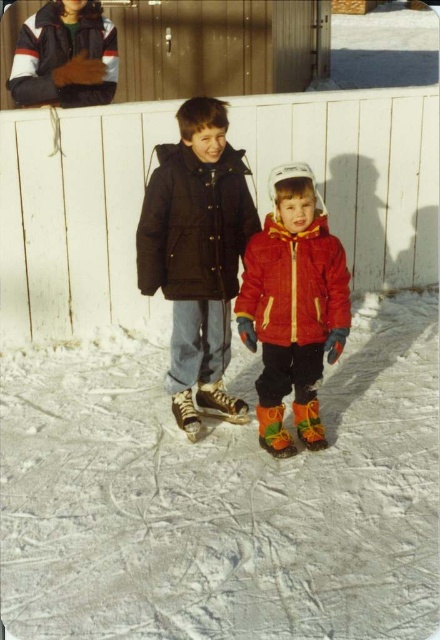
Question: Based on their relative distances, which object is nearer to the matte black jacket at center?

Choices:
 (A) brushed metal jacket at upper left
 (B) matte red jacket at center
 (C) white matte ice at center
 (D) black puffy jacket at center

Answer: (D)

Question: From the image, what is the correct spatial relationship of matte black jacket at center in relation to black puffy jacket at center?

Choices:
 (A) below
 (B) above

Answer: (A)

Question: Which object is the closest to the brushed metal jacket at upper left?

Choices:
 (A) red matte jacket at center
 (B) matte red jacket at center
 (C) white matte ice at center

Answer: (B)

Question: Considering the real-world distances, which object is closest to the brushed metal jacket at upper left?

Choices:
 (A) white matte ice at center
 (B) red matte jacket at center
 (C) matte black jacket at center

Answer: (C)

Question: Can you confirm if black puffy jacket at center is positioned to the left of brushed metal jacket at upper left?

Choices:
 (A) yes
 (B) no

Answer: (B)

Question: Does white matte ice at center appear on the left side of red matte jacket at center?

Choices:
 (A) no
 (B) yes

Answer: (B)